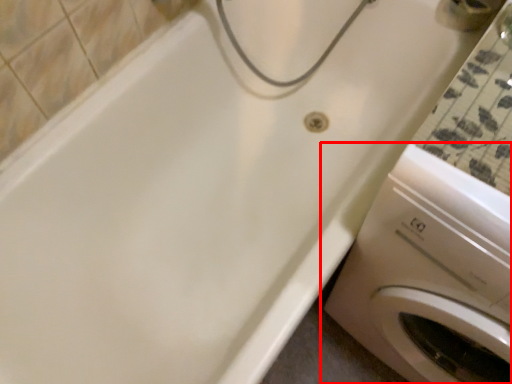
Question: Considering the relative positions of washing machine (annotated by the red box) and faucet in the image provided, where is washing machine (annotated by the red box) located with respect to the staircase?

Choices:
 (A) right
 (B) left

Answer: (B)